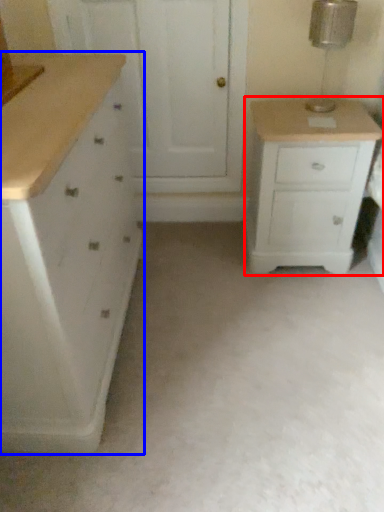
Question: Which object is further to the camera taking this photo, chest of drawers (highlighted by a red box) or chest of drawers (highlighted by a blue box)?

Choices:
 (A) chest of drawers
 (B) chest of drawers

Answer: (A)